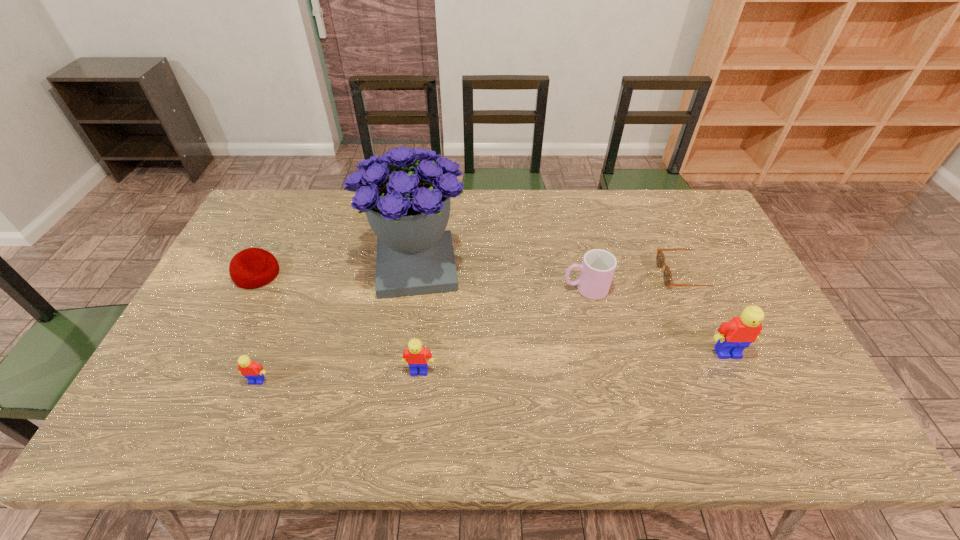
You are a GUI agent. You are given a task and a screenshot of the screen. Output one action in this format:
    pyautogui.click(x=<x>, y=<y>)
    Task: Click on the vacant area that lies between the nearest object and the bouquet
    The image size is (960, 540).
    Given the screenshot: What is the action you would take?
    pyautogui.click(x=337, y=324)

Where is `free space between the shortest object and the fifth tallest object`? This screenshot has height=540, width=960. free space between the shortest object and the fifth tallest object is located at coordinates (471, 328).

This screenshot has width=960, height=540. What are the coordinates of `vacant point located between the tallest object and the sunglasses` in the screenshot? It's located at (551, 271).

You are a GUI agent. You are given a task and a screenshot of the screen. Output one action in this format:
    pyautogui.click(x=<x>, y=<y>)
    Task: Click on the free area in between the second Lego from right to left and the nearest Lego
    Image resolution: width=960 pixels, height=540 pixels.
    Given the screenshot: What is the action you would take?
    pyautogui.click(x=338, y=376)

Identify the location of vacant space that is in between the tallest object and the nearest Lego. The width and height of the screenshot is (960, 540). click(x=337, y=324).

Locate an element on the screen. This screenshot has width=960, height=540. unoccupied area between the sixth tallest object and the sixth farthest object is located at coordinates (338, 322).

Locate an element on the screen. This screenshot has height=540, width=960. free space between the beanbag and the second nearest object is located at coordinates (338, 322).

The image size is (960, 540). I want to click on vacant area between the nearest object and the second nearest Lego, so click(x=338, y=376).

Locate an element on the screen. Image resolution: width=960 pixels, height=540 pixels. vacant space in between the fifth object from left to right and the nearest Lego is located at coordinates (421, 335).

Identify which object is the sixth nearest to the fifth object from left to right. Please provide its 2D coordinates. Your answer should be formatted as a tuple, i.e. [(x, y)], where the tuple contains the x and y coordinates of a point satisfying the conditions above.

[(251, 268)]